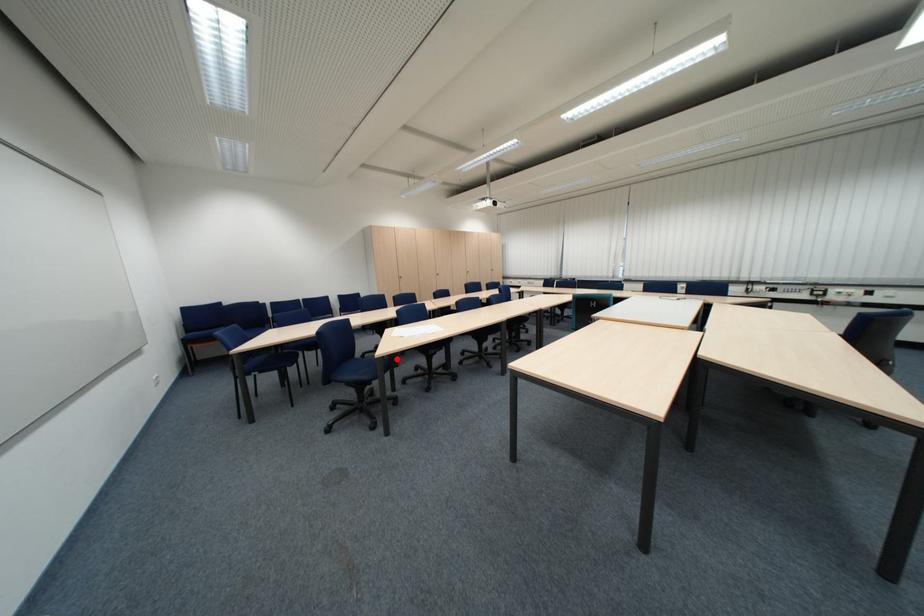
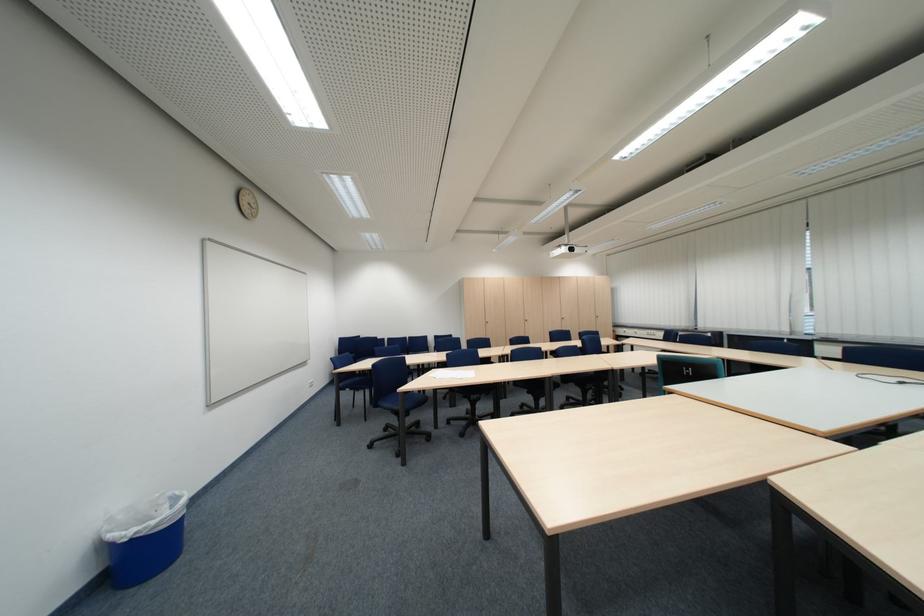
Question: I am providing you with two images of the same scene from different viewpoints. A red point is shown in image1. For the corresponding object point in image2, is it positioned nearer or farther from the camera?

Choices:
 (A) Nearer
 (B) Farther

Answer: (B)